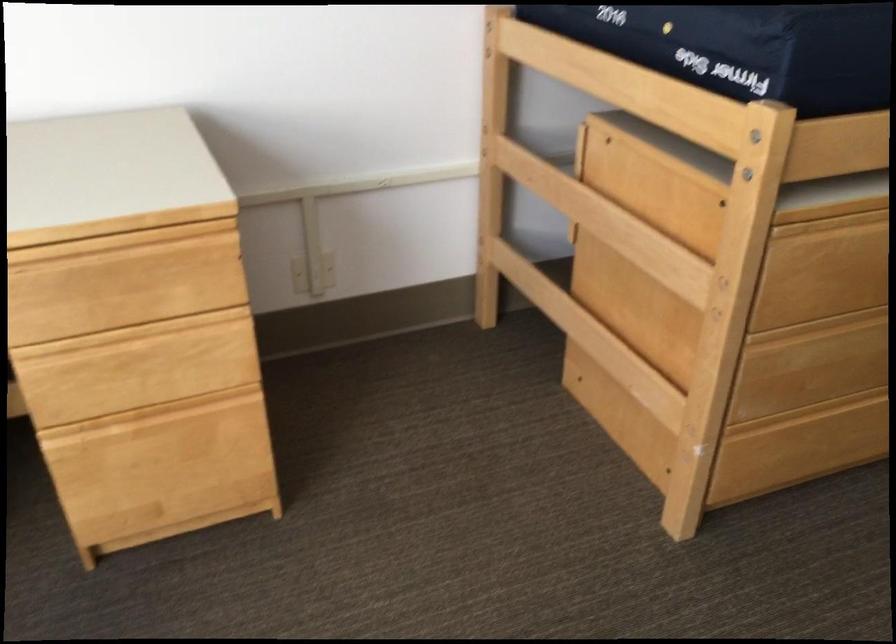
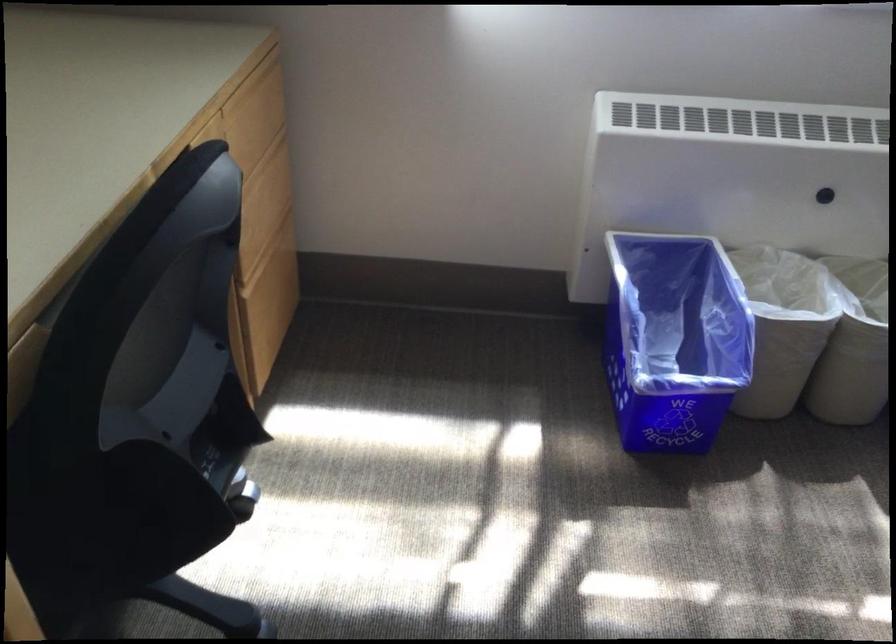
The first image is from the beginning of the video and the second image is from the end. How did the camera likely rotate when shooting the video?

The camera rotated toward left-down.